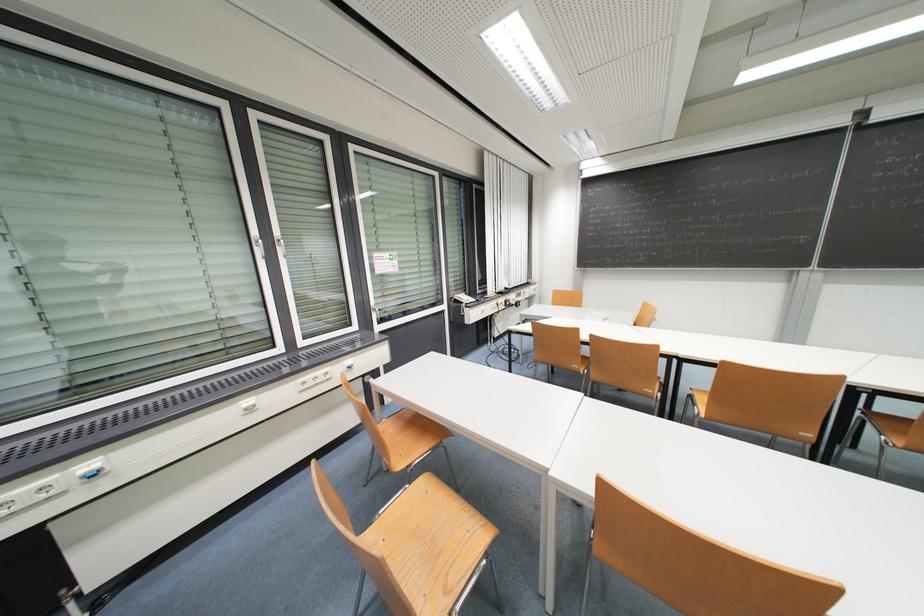
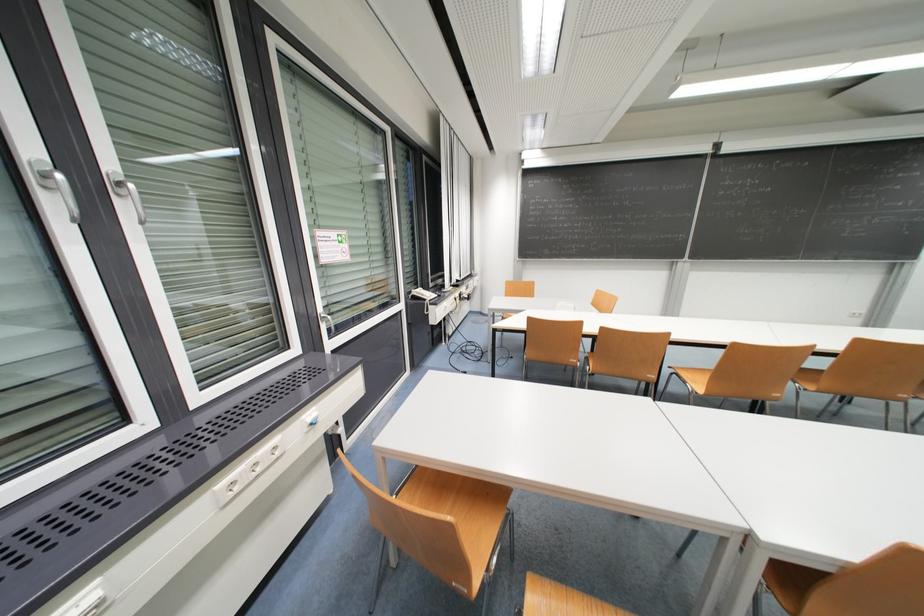
In the second image, find the point that corresponds to point 730,365 in the first image.

(739, 346)